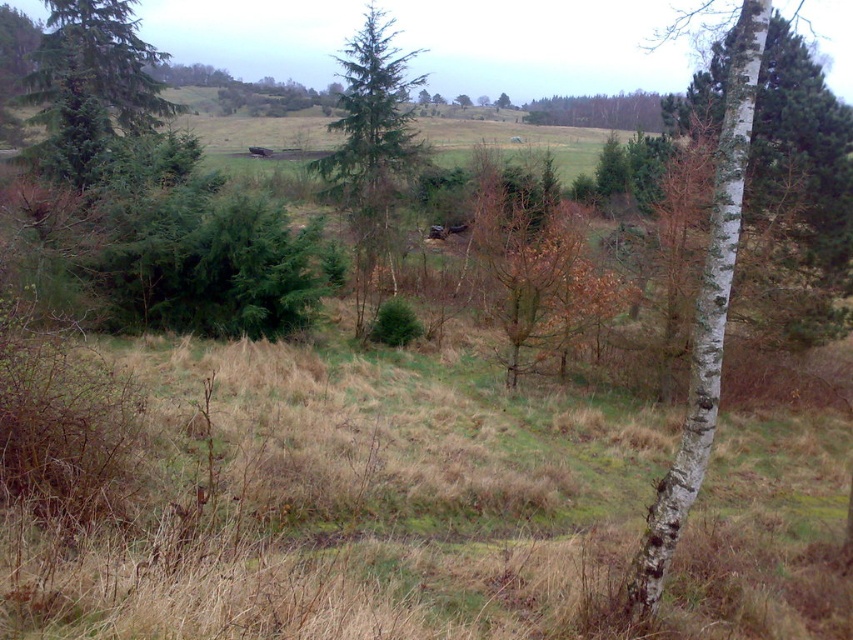
Question: Does green matte tree at left have a larger size compared to green matte tree at center?

Choices:
 (A) no
 (B) yes

Answer: (A)

Question: Does green matte tree at left appear under green matte tree at center?

Choices:
 (A) no
 (B) yes

Answer: (B)

Question: Which of the following is the farthest from the observer?

Choices:
 (A) green leafy tree at upper center
 (B) green matte tree at center

Answer: (A)

Question: Which object is farther from the camera taking this photo?

Choices:
 (A) green matte tree at left
 (B) green matte tree at center
 (C) green leafy tree at upper center

Answer: (C)

Question: Which of the following is the closest to the observer?

Choices:
 (A) green leafy tree at upper center
 (B) green matte tree at left
 (C) green matte tree at center

Answer: (B)

Question: Can you confirm if green matte tree at center is positioned below green leafy tree at upper center?

Choices:
 (A) yes
 (B) no

Answer: (A)